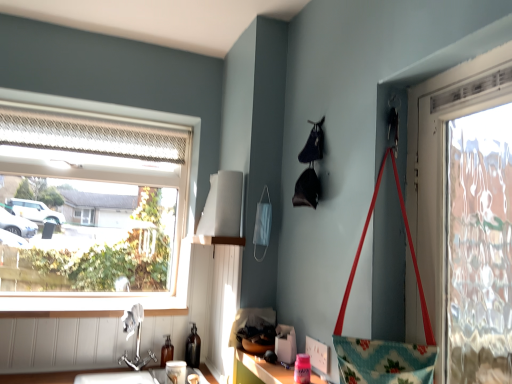
You are a GUI agent. You are given a task and a screenshot of the screen. Output one action in this format:
    pyautogui.click(x=<x>, y=<y>)
    Task: Click on the vacant space situated above floral fabric handbag at right (from a real-world perspective)
    
    Given the screenshot: What is the action you would take?
    [393, 155]